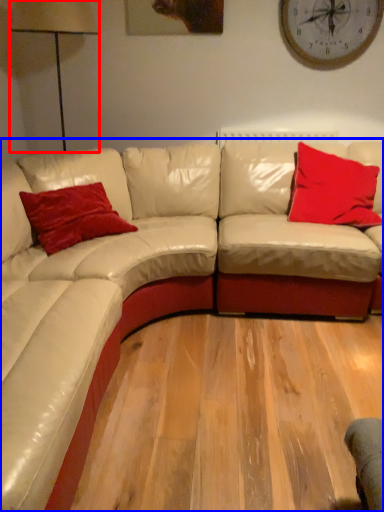
Question: Which object is closer to the camera taking this photo, table lamp (highlighted by a red box) or studio couch (highlighted by a blue box)?

Choices:
 (A) table lamp
 (B) studio couch

Answer: (B)